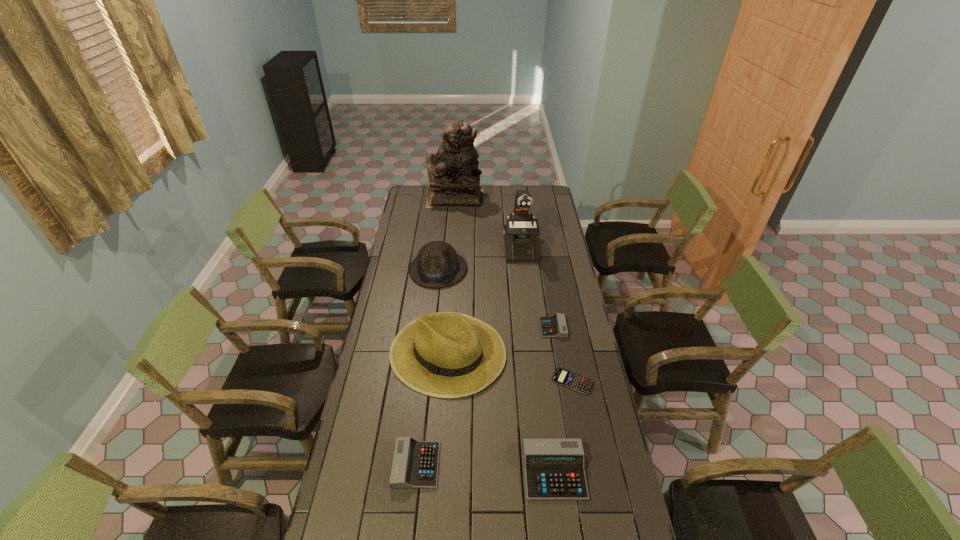
I want to click on free space located 0.120m on the front of the shortest calculator, so click(581, 424).

Find the location of `object located at the far edge`. object located at the far edge is located at coordinates (453, 181).

Image resolution: width=960 pixels, height=540 pixels. In order to click on sculpture at the left edge in this screenshot , I will do `click(453, 181)`.

Find the location of a particular element. Image resolution: width=960 pixels, height=540 pixels. sunhat located at the left edge is located at coordinates (447, 355).

You are a GUI agent. You are given a task and a screenshot of the screen. Output one action in this format:
    pyautogui.click(x=<x>, y=<y>)
    Task: Click on the bowler hat present at the left edge
    This screenshot has width=960, height=540.
    Given the screenshot: What is the action you would take?
    pyautogui.click(x=437, y=264)

Where is `microscope positioned at the right edge`? This screenshot has height=540, width=960. microscope positioned at the right edge is located at coordinates point(521,245).

Identify the location of object present at the far left corner. This screenshot has width=960, height=540. (453, 181).

The height and width of the screenshot is (540, 960). I want to click on free space at the left edge of the desktop, so click(x=409, y=214).

This screenshot has width=960, height=540. I want to click on free spot at the right edge of the desktop, so click(x=595, y=410).

Where is `vacant space at the far left corner`? This screenshot has width=960, height=540. vacant space at the far left corner is located at coordinates (421, 198).